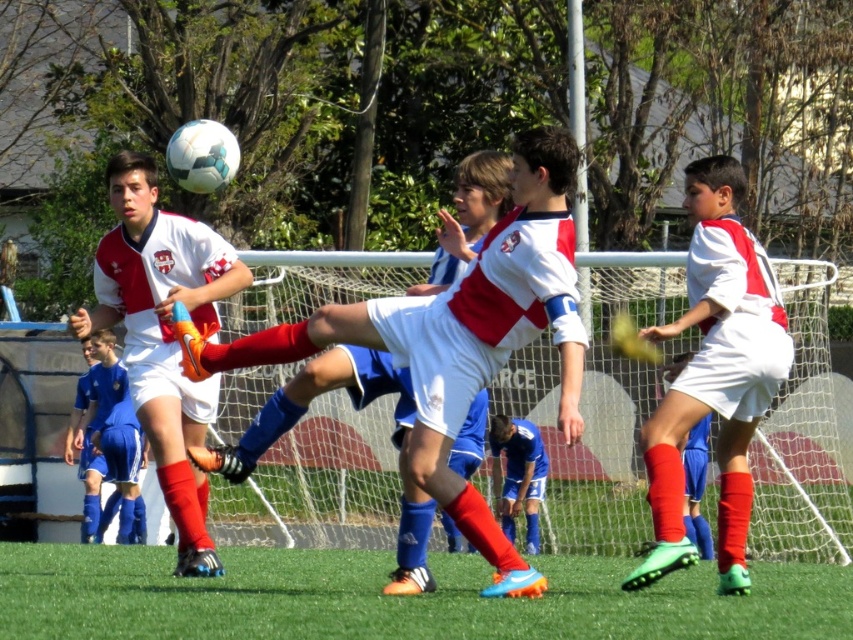
Who is more forward, (x=488, y=244) or (x=511, y=534)?

Positioned in front is point (x=488, y=244).

Between matte white soccer ball at center and blue matte soccer player at lower center, which one is positioned lower?

blue matte soccer player at lower center is lower down.

Is point (523, 250) positioned before point (491, 444)?

Yes, point (523, 250) is in front of point (491, 444).

Locate an element on the screen. matte white soccer ball at center is located at coordinates (459, 337).

Consider the image. Who is lower down, matte white soccer ball at upper center or blue matte soccer player at lower center?

blue matte soccer player at lower center is below.

Between point (109, 312) and point (514, 440), which one is positioned in front?

Positioned in front is point (109, 312).

Find the location of `matte white soccer ball at upper center`. matte white soccer ball at upper center is located at coordinates (163, 333).

Does green turf at center appear on the right side of matte white soccer ball at center?

Yes, green turf at center is to the right of matte white soccer ball at center.

Which is more to the left, green turf at center or matte white soccer ball at center?

Positioned to the left is matte white soccer ball at center.

Does point (840, 628) come in front of point (527, 282)?

Yes, point (840, 628) is in front of point (527, 282).

Find the location of a particular element. The image size is (853, 640). green turf at center is located at coordinates (395, 596).